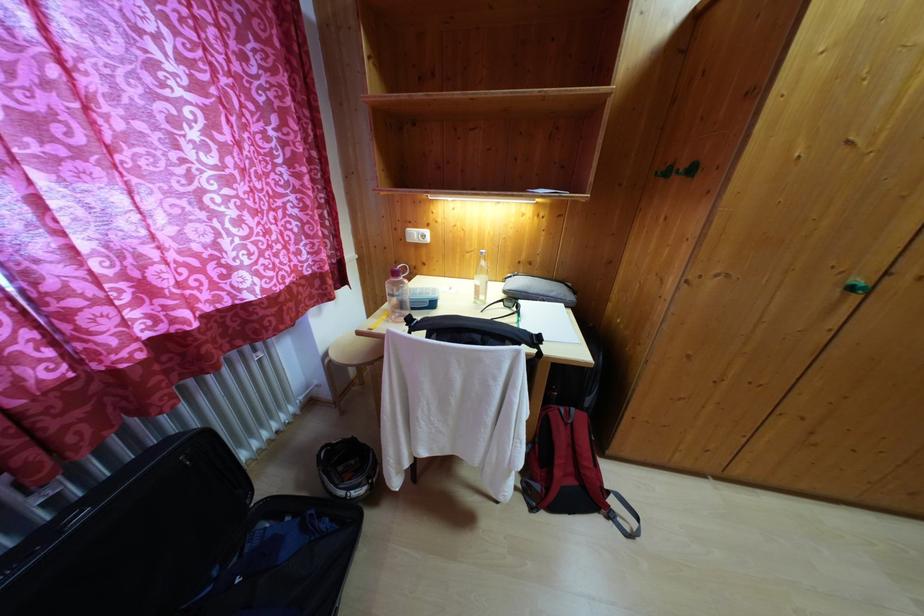
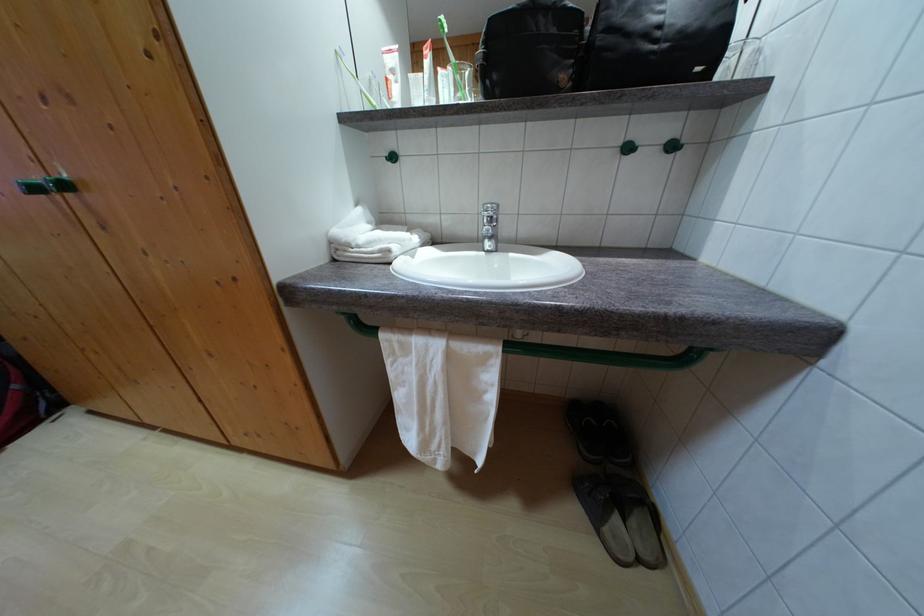
Question: Which direction would the cameraman need to move to produce the second image? Reply with the corresponding letter.

Choices:
 (A) Left
 (B) Right
 (C) Forward
 (D) Backward

Answer: (B)